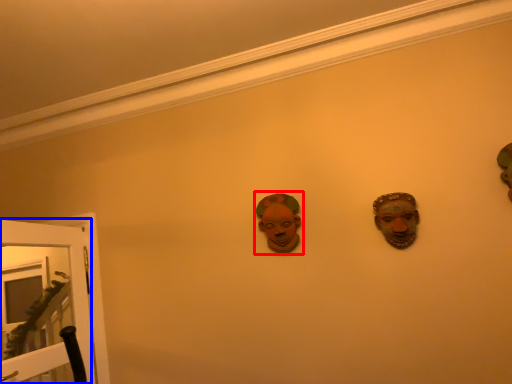
Question: Among these objects, which one is nearest to the camera, person (highlighted by a red box) or door (highlighted by a blue box)?

Choices:
 (A) person
 (B) door

Answer: (B)